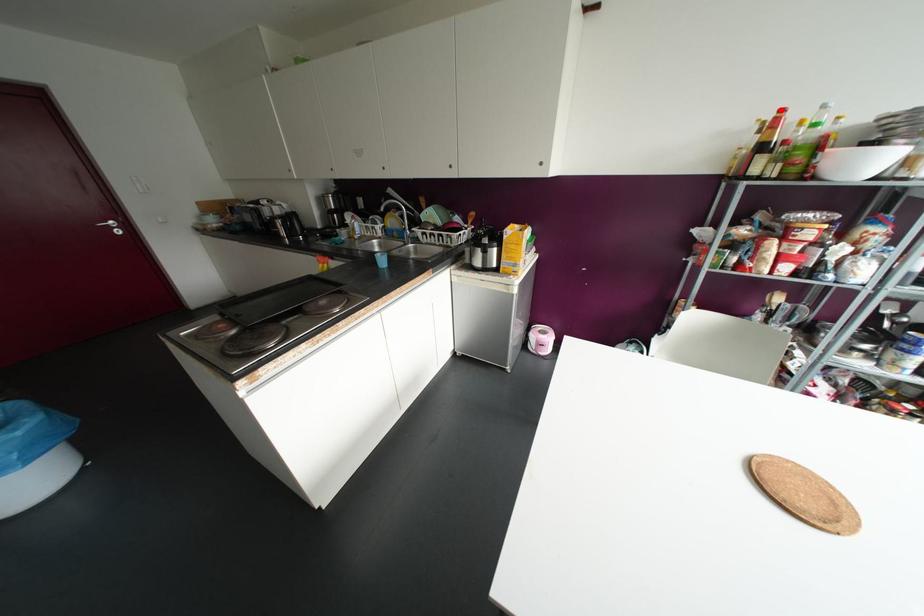
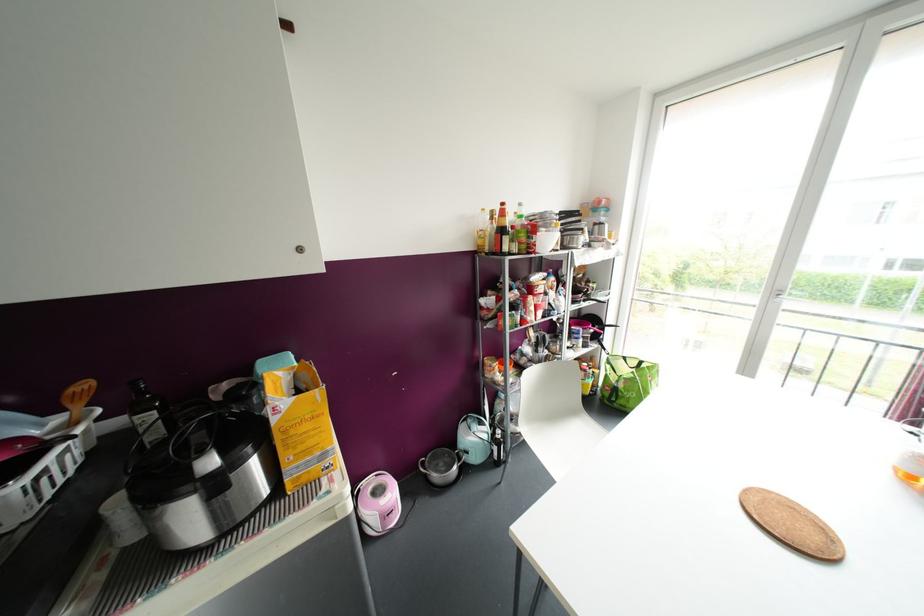
In the second image, find the point that corresponds to the highlighted location in the first image.

(502, 204)